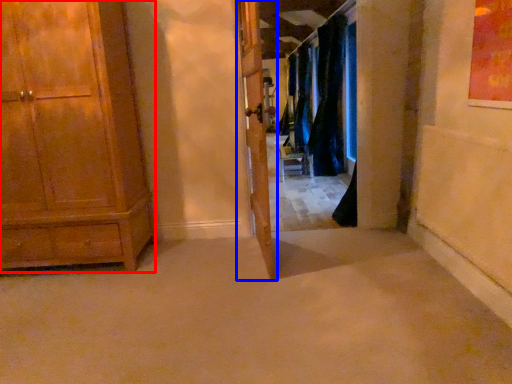
Question: Which object is closer to the camera taking this photo, cabinetry (highlighted by a red box) or door (highlighted by a blue box)?

Choices:
 (A) cabinetry
 (B) door

Answer: (B)